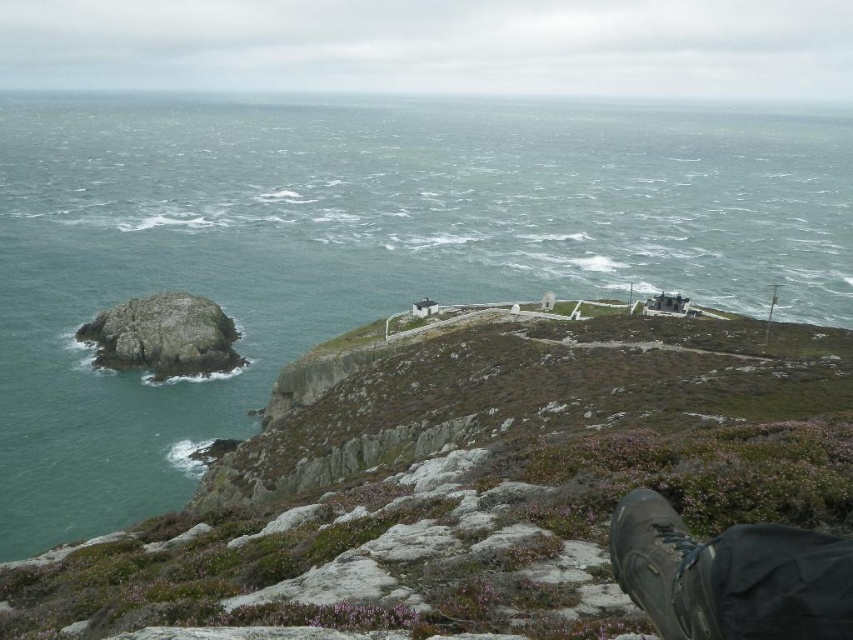
You are standing at the edge of a cliff overlooking the ocean. You see a green mossy rock at upper center and a black leather boot at lower right. Which object is closer to the cliff edge?

The black leather boot at lower right is closer to the cliff edge because it is positioned below the green mossy rock at upper center, indicating it is lower in the scene.

You are standing at the edge of a cliff overlooking a rugged coastal landscape. There is a point marked at coordinates point (3, 236). Given that you are 471.38 feet away from this point, would you be able to safely throw a rock to reach it without crossing the cliff edge?

The point (3, 236) is 471.38 feet away from the viewer. Since the distance is quite large, it would be challenging to throw a rock that far, especially considering the rugged terrain and windy conditions described in the scene. Therefore, it is unlikely you could safely reach the point without crossing the cliff edge.

You are standing at the edge of the cliff and want to place a small flag at the point marked by point (730, 577). The flag is 10 cm tall. Is there enough space between the brown suede boot at lower right and the edge of the cliff to place the flag without it being in the boot?

The point (730, 577) marks the brown suede boot at lower right, so placing a flag there would be directly under the boot. Therefore, there is no space to place the flag without it being in the boot.